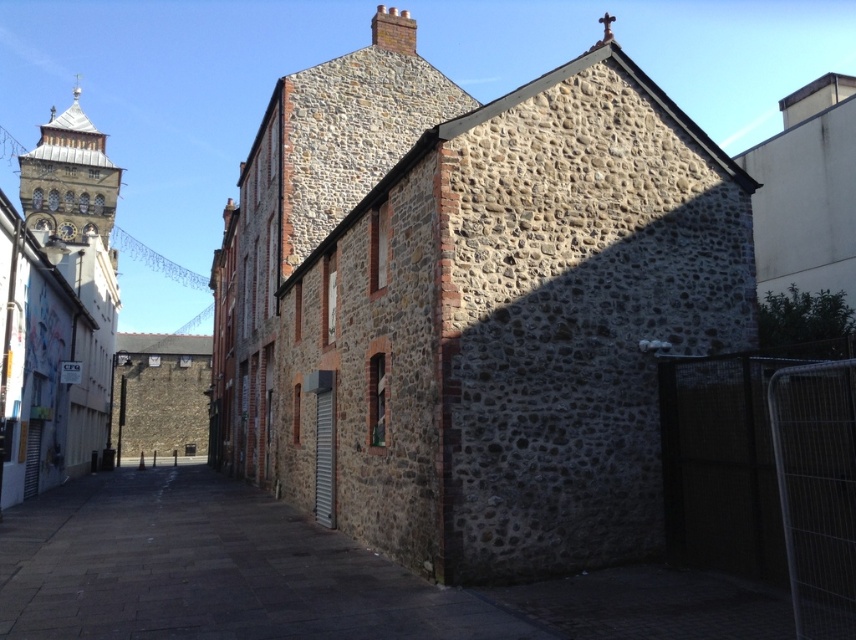
Between stone textured church at center and stone clock tower at left, which one has less height?

Standing shorter between the two is stone textured church at center.

Does point (339, 99) come closer to viewer compared to point (31, 289)?

No, (339, 99) is further to viewer.

Which is in front, point (248, 246) or point (36, 404)?

Positioned in front is point (36, 404).

Image resolution: width=856 pixels, height=640 pixels. Identify the location of stone textured church at center. (473, 305).

Does point (274, 570) come in front of point (19, 186)?

Yes.

In the scene shown: How much distance is there between dark stone alley at center and stone clock tower at upper left?

dark stone alley at center and stone clock tower at upper left are 413.31 feet apart.

Between point (13, 515) and point (94, 182), which one is positioned in front?

Point (13, 515)

Locate an element on the screen. This screenshot has width=856, height=640. dark stone alley at center is located at coordinates (210, 570).

Between point (559, 481) and point (372, 557), which one is positioned in front?

Point (559, 481) is more forward.

Based on the photo, who is positioned more to the right, stone textured church at center or dark stone alley at center?

From the viewer's perspective, stone textured church at center appears more on the right side.

At what (x,y) coordinates should I click in order to perform the action: click on stone textured church at center. Please return your answer as a coordinate pair (x, y). The height and width of the screenshot is (640, 856). Looking at the image, I should click on (473, 305).

This screenshot has width=856, height=640. What are the coordinates of `stone textured church at center` in the screenshot? It's located at (473, 305).